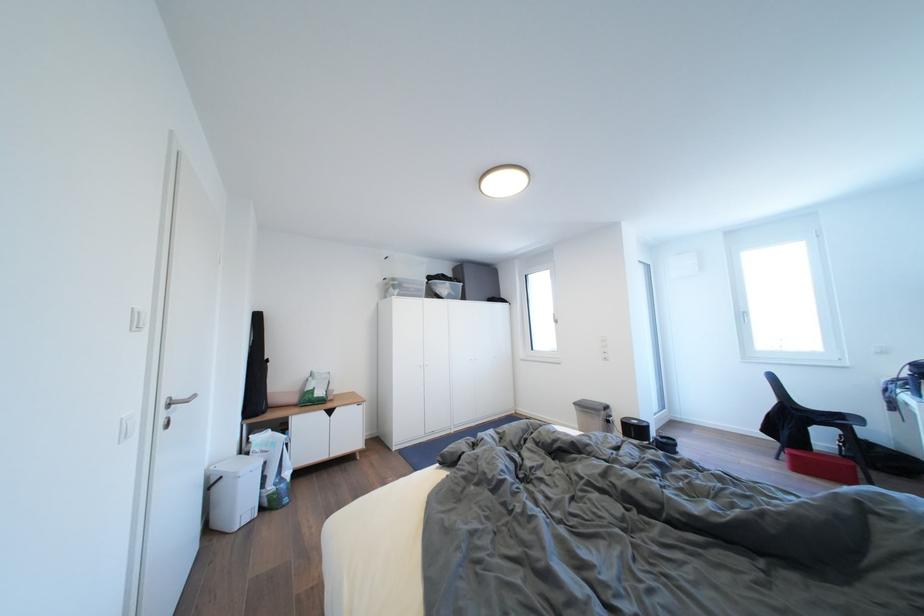
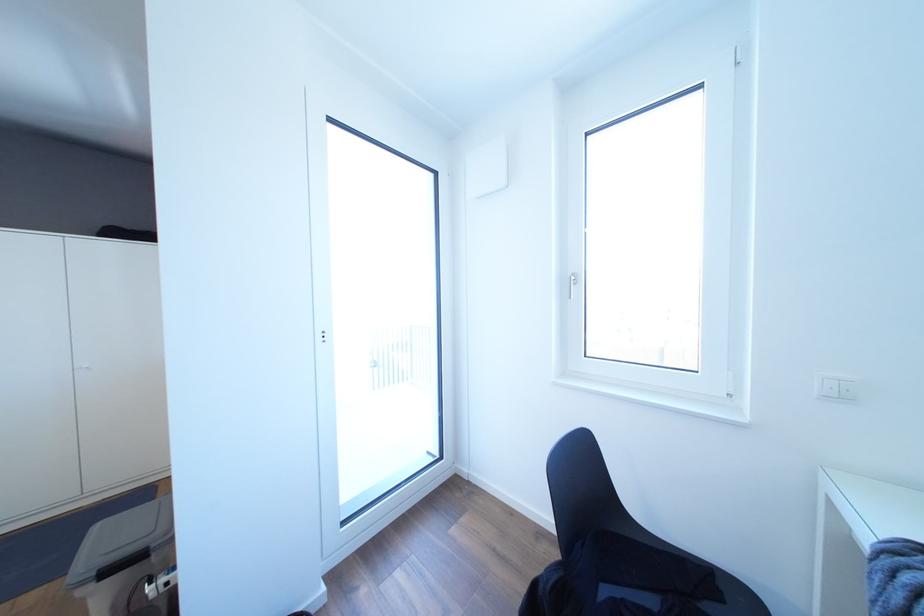
In a continuous first-person perspective shot, in which direction is the camera moving?

The movement direction of the cameraman is right, forward.